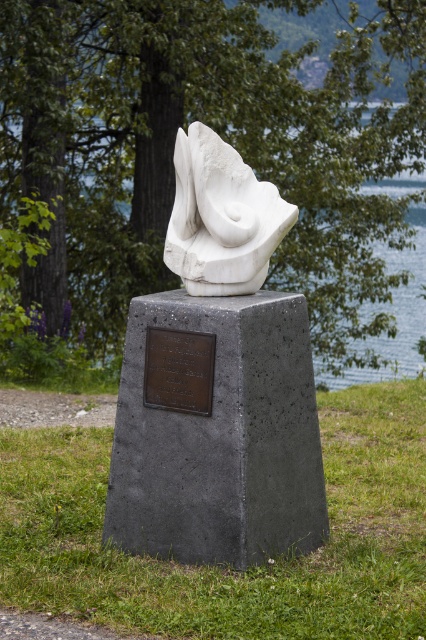
Who is more forward, (209, 492) or (347, 381)?

Point (209, 492) is more forward.

Measure the distance between gray concrete pedestal at center and camera.

The distance of gray concrete pedestal at center from camera is 13.97 feet.

You are a GUI agent. You are given a task and a screenshot of the screen. Output one action in this format:
    pyautogui.click(x=<x>, y=<y>)
    Task: Click on the gray concrete pedestal at center
    
    Given the screenshot: What is the action you would take?
    pyautogui.click(x=216, y=429)

Can you confirm if white marble bust at center is bigger than blue water at center?

No.

Between white marble bust at center and blue water at center, which one appears on the left side from the viewer's perspective?

From the viewer's perspective, white marble bust at center appears more on the left side.

Who is more forward, (x=278, y=209) or (x=368, y=106)?

Point (x=278, y=209)

The height and width of the screenshot is (640, 426). Find the location of `white marble bust at center`. white marble bust at center is located at coordinates (221, 218).

Does white marble bust at center have a larger size compared to bronze plaque at center?

Indeed, white marble bust at center has a larger size compared to bronze plaque at center.

Is white marble bust at center shorter than bronze plaque at center?

No.

Does point (227, 160) lie in front of point (201, 380)?

No, (227, 160) is further to viewer.

Find the location of a particular element. This screenshot has width=426, height=640. white marble bust at center is located at coordinates (221, 218).